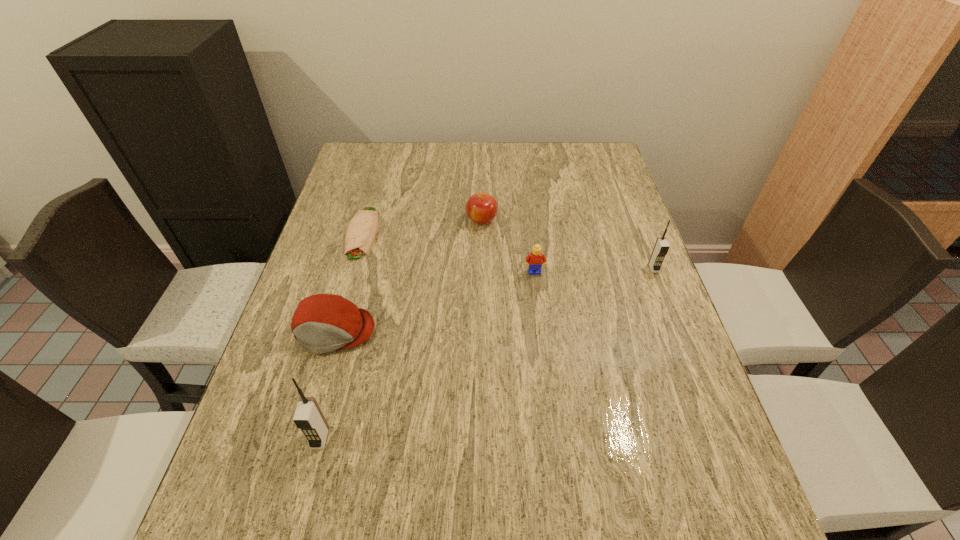
Identify the location of the nearer cellular telephone. The width and height of the screenshot is (960, 540). (308, 417).

Find the location of a particular element. the tallest object is located at coordinates (308, 417).

In order to click on the farther cellular telephone in this screenshot , I will do `click(661, 248)`.

Locate an element on the screen. Image resolution: width=960 pixels, height=540 pixels. the right cellular telephone is located at coordinates (661, 248).

Where is `Lego`? Image resolution: width=960 pixels, height=540 pixels. Lego is located at coordinates (534, 260).

I want to click on apple, so click(x=481, y=208).

You are a GUI agent. You are given a task and a screenshot of the screen. Output one action in this format:
    pyautogui.click(x=<x>, y=<y>)
    Task: Click on the shortest object
    This screenshot has height=540, width=960.
    Given the screenshot: What is the action you would take?
    pyautogui.click(x=360, y=234)

I want to click on cap, so click(x=323, y=322).

Locate an element on the screen. vacant area situated 0.190m on the front-facing side of the second object from right to left is located at coordinates (542, 335).

Find the location of a particular element. The width and height of the screenshot is (960, 540). vacant space situated on the right of the apple is located at coordinates (545, 220).